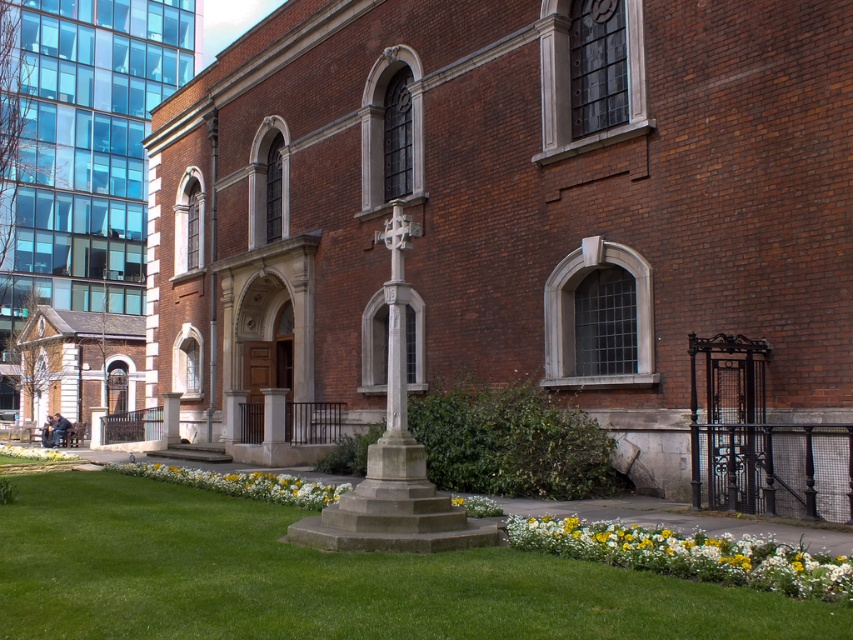
Question: In this image, where is yellow fabric flower at center located relative to yellow fabric flower at lower left?

Choices:
 (A) above
 (B) below

Answer: (A)

Question: Among these objects, which one is nearest to the camera?

Choices:
 (A) yellow matte flowers at lower center
 (B) green grass at center

Answer: (B)

Question: Which object is closer to the camera taking this photo?

Choices:
 (A) yellow matte flowers at lower center
 (B) yellow fabric flower at center
 (C) green grass at center
 (D) yellow fabric flower at lower left

Answer: (C)

Question: Estimate the real-world distances between objects in this image. Which object is farther from the yellow fabric flower at lower left?

Choices:
 (A) yellow fabric flower at center
 (B) green grass at center

Answer: (B)

Question: Can you confirm if green grass at center is smaller than yellow fabric flower at lower left?

Choices:
 (A) no
 (B) yes

Answer: (B)

Question: Observing the image, what is the correct spatial positioning of yellow fabric flower at center in reference to yellow fabric flower at lower left?

Choices:
 (A) left
 (B) right

Answer: (B)